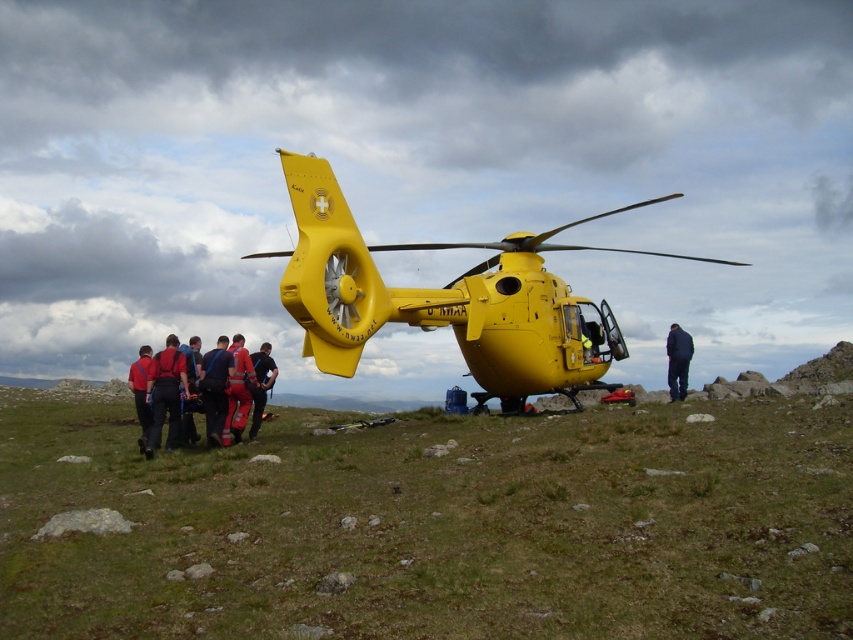
You are a photographer trying to capture a clear shot of both the dark blue fabric pants at right and the red reflective suit at center. Since you want to ensure both are visible in the frame, which object should you focus on to account for their size difference?

The dark blue fabric pants at right is wider than the red reflective suit at center, so focusing on the dark blue fabric pants at right would ensure both are visible in the frame due to its larger size.

You are a drone operator trying to capture a photo of the helicopter and the rescue team. You need to ensure both the helicopter and the rescue team members at point (187,385) and point (258,419) are in focus. Since the depth of field is limited, you can only focus on one point. Which point should you choose to ensure the helicopter and the closer team member are sharp?

You should focus on point (187,385) because it is closer to the camera than point (258,419). This will keep both the helicopter and the closer team member in focus, while the farther point may be slightly blurred.

You are a photographer positioned at the base of the helicopter. You notice two items in the scene described as dark blue fabric pants at right and red reflective suit at center. Which one is higher up from your viewpoint?

The dark blue fabric pants at right is above the red reflective suit at center, so it is higher up from your viewpoint.